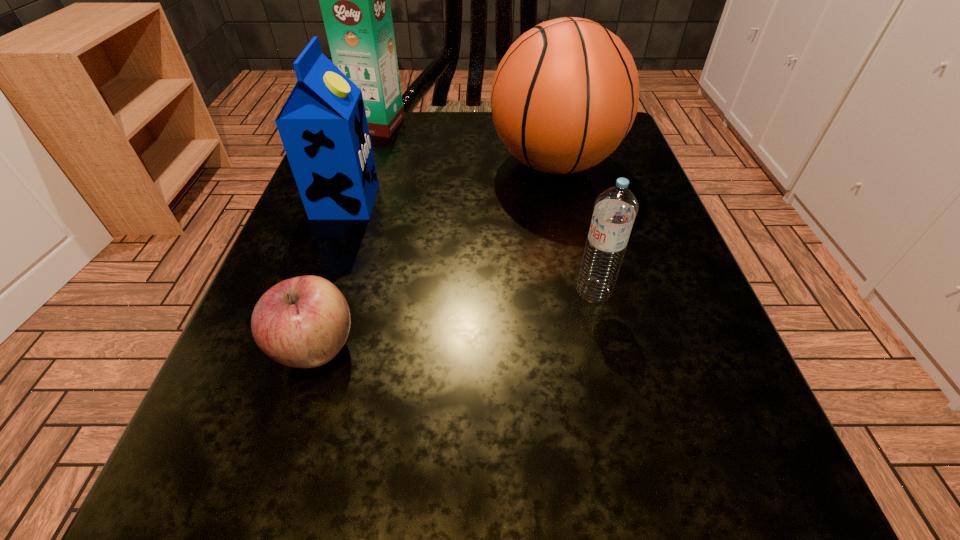
This screenshot has width=960, height=540. In order to click on free space located 0.140m on the left of the second nearest object in this screenshot , I will do `click(471, 292)`.

Where is `blank area located on the front of the apple`? The height and width of the screenshot is (540, 960). blank area located on the front of the apple is located at coordinates (265, 513).

Find the location of a particular element. The height and width of the screenshot is (540, 960). carton at the far edge is located at coordinates (355, 0).

Identify the location of basketball that is positioned at the far edge. (564, 96).

This screenshot has width=960, height=540. Find the location of `apple that is positioned at the left edge`. apple that is positioned at the left edge is located at coordinates (303, 322).

This screenshot has height=540, width=960. In order to click on basketball at the right edge in this screenshot , I will do `click(564, 96)`.

Where is `water bottle located in the right edge section of the desktop`? This screenshot has width=960, height=540. water bottle located in the right edge section of the desktop is located at coordinates (615, 209).

You are a GUI agent. You are given a task and a screenshot of the screen. Output one action in this format:
    pyautogui.click(x=<x>, y=<y>)
    Task: Click on the object present at the far left corner
    
    Given the screenshot: What is the action you would take?
    pyautogui.click(x=355, y=0)

Where is `object at the far right corner`? object at the far right corner is located at coordinates tap(564, 96).

Identify the location of free space at the far edge. (419, 171).